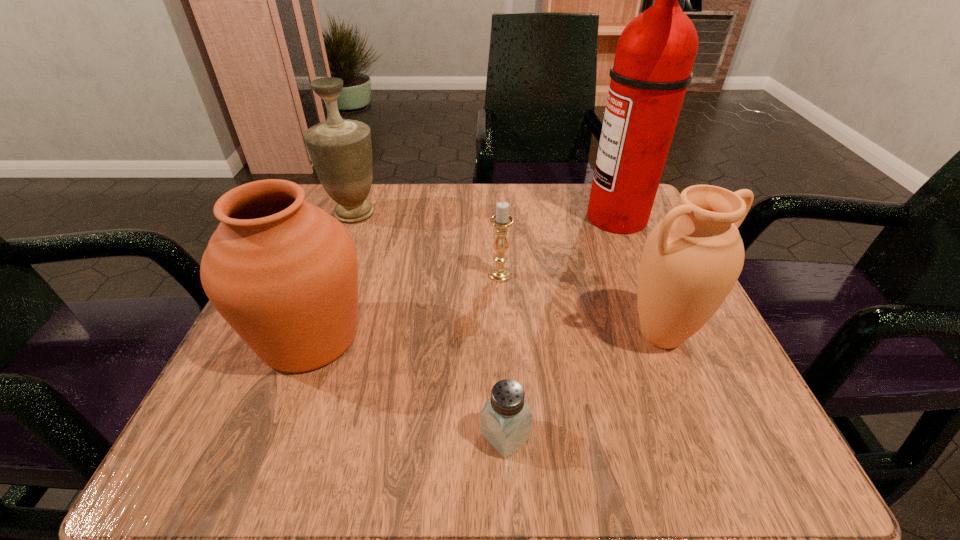
You are a GUI agent. You are given a task and a screenshot of the screen. Output one action in this format:
    pyautogui.click(x=<x>, y=<y>)
    Task: Click on the fire extinguisher
    
    Given the screenshot: What is the action you would take?
    pyautogui.click(x=655, y=54)

I want to click on the farthest urn, so click(340, 149).

This screenshot has height=540, width=960. Find the location of `the rightmost urn`. the rightmost urn is located at coordinates (691, 260).

Identify the location of the third farthest object. (501, 220).

You are a GUI agent. You are given a task and a screenshot of the screen. Output one action in this format:
    pyautogui.click(x=<x>, y=<y>)
    Task: Click on the second shortest object
    The image size is (960, 540).
    Given the screenshot: What is the action you would take?
    pyautogui.click(x=501, y=220)

Locate an element on the screen. This screenshot has height=540, width=960. the shortest object is located at coordinates (505, 421).

You are a GUI agent. You are given a task and a screenshot of the screen. Output one action in this format:
    pyautogui.click(x=<x>, y=<y>)
    Task: Click on the nearest object
    The height and width of the screenshot is (540, 960).
    Given the screenshot: What is the action you would take?
    pyautogui.click(x=505, y=421)

This screenshot has width=960, height=540. Find the location of `free point located on the side of the fire extinguisher near the handle`. free point located on the side of the fire extinguisher near the handle is located at coordinates (408, 218).

Locate an element on the screen. The width and height of the screenshot is (960, 540). vacant space situated 0.210m on the side of the fire extinguisher near the handle is located at coordinates (487, 218).

This screenshot has width=960, height=540. I want to click on free space located on the side of the fire extinguisher near the handle, so click(459, 218).